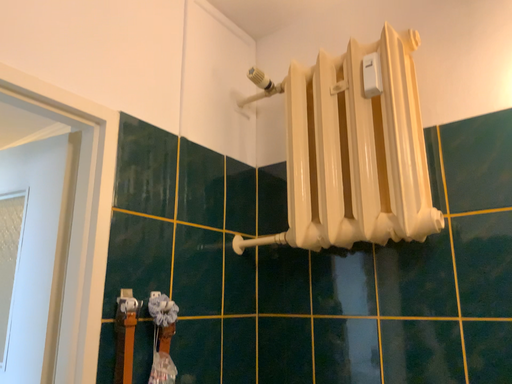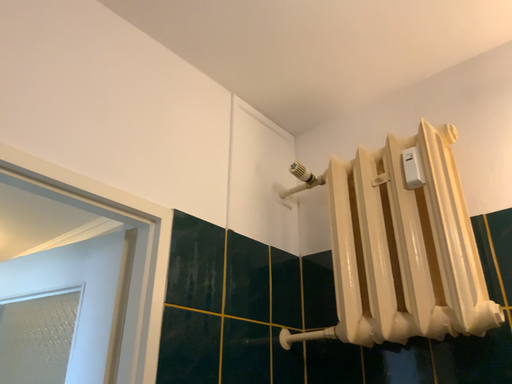
Question: How did the camera likely rotate when shooting the video?

Choices:
 (A) rotated upward
 (B) rotated downward

Answer: (A)